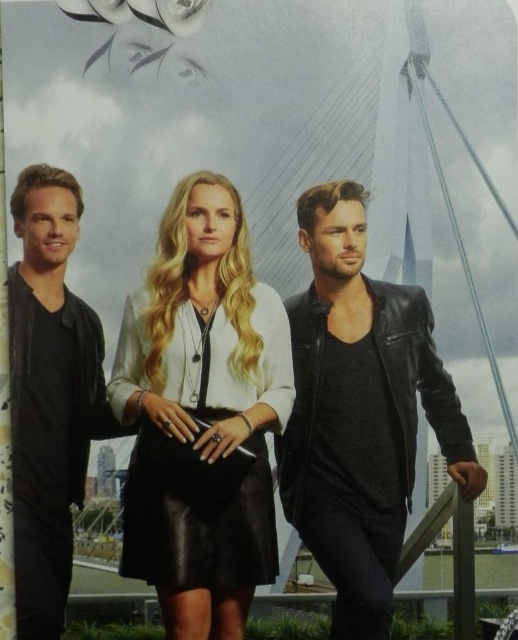
Question: Considering the real-world distances, which object is closest to the black leather skirt at center?

Choices:
 (A) black leather jacket at center
 (B) matte black leather jacket at left

Answer: (A)

Question: Considering the relative positions of black leather skirt at center and black leather jacket at center in the image provided, where is black leather skirt at center located with respect to black leather jacket at center?

Choices:
 (A) above
 (B) below

Answer: (A)

Question: Is black leather skirt at center bigger than black leather jacket at center?

Choices:
 (A) yes
 (B) no

Answer: (B)

Question: Can you confirm if black leather jacket at center is positioned below matte black leather jacket at left?

Choices:
 (A) yes
 (B) no

Answer: (A)

Question: Which point is farther to the camera?

Choices:
 (A) click(x=207, y=499)
 (B) click(x=52, y=221)

Answer: (B)

Question: Which point is closer to the camera?

Choices:
 (A) (193, 336)
 (B) (57, 301)

Answer: (A)